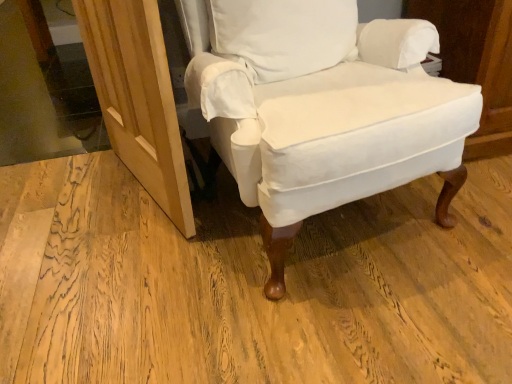
In order to face transparent glass door at upper left, should I rotate leftwards or rightwards?

Rotate left and turn 24.914 degrees.

Where is `white cotton chair at center`? The height and width of the screenshot is (384, 512). white cotton chair at center is located at coordinates (349, 134).

In order to face white cotton pillow at center, should I rotate leftwards or rightwards?

Turn right by 4.790 degrees to look at white cotton pillow at center.

Locate an element on the screen. The image size is (512, 384). natural wood screen door at lower left is located at coordinates (138, 98).

Locate an element on the screen. Image resolution: width=512 pixels, height=384 pixels. pillow on the right of transparent glass door at upper left is located at coordinates (284, 35).

Based on their positions, is white cotton pillow at center located to the left or right of transparent glass door at upper left?

From the image, it's evident that white cotton pillow at center is to the right of transparent glass door at upper left.

Who is shorter, white cotton pillow at center or transparent glass door at upper left?

transparent glass door at upper left.

Does point (336, 20) appear closer or farther from the camera than point (73, 132)?

Point (336, 20) appears to be closer to the viewer than point (73, 132).

Is transparent glass door at upper left at the back of natural wood screen door at lower left?

No, transparent glass door at upper left is not at the back of natural wood screen door at lower left.

Does natural wood screen door at lower left contain transparent glass door at upper left?

No, natural wood screen door at lower left does not contain transparent glass door at upper left.

Is natural wood screen door at lower left taller than transparent glass door at upper left?

Indeed, natural wood screen door at lower left has a greater height compared to transparent glass door at upper left.

Is natural wood screen door at lower left far away from transparent glass door at upper left?

Actually, natural wood screen door at lower left and transparent glass door at upper left are a little close together.

From the image's perspective, is transparent glass door at upper left on top of white cotton pillow at center?

Yes, from the image's perspective, transparent glass door at upper left is above white cotton pillow at center.

Which of these two, transparent glass door at upper left or white cotton pillow at center, is bigger?

transparent glass door at upper left is bigger.

Measure the distance between transparent glass door at upper left and white cotton pillow at center.

A distance of 1.35 meters exists between transparent glass door at upper left and white cotton pillow at center.

Is point (65, 100) behind point (347, 2)?

Yes, it is.

Does point (321, 55) lie behind point (172, 125)?

Yes, point (321, 55) is farther from viewer.

Can you confirm if white cotton pillow at center is taller than natural wood screen door at lower left?

In fact, white cotton pillow at center may be shorter than natural wood screen door at lower left.

Can you confirm if white cotton pillow at center is smaller than natural wood screen door at lower left?

Yes, white cotton pillow at center is smaller than natural wood screen door at lower left.

Which of these two, white cotton pillow at center or natural wood screen door at lower left, is thinner?

natural wood screen door at lower left.

Considering the relative positions of white cotton pillow at center and white cotton chair at center in the image provided, is white cotton pillow at center to the left of white cotton chair at center from the viewer's perspective?

Yes, white cotton pillow at center is to the left of white cotton chair at center.

Considering the points (214, 23) and (273, 87), which point is in front, point (214, 23) or point (273, 87)?

Positioned in front is point (273, 87).

Can you confirm if white cotton pillow at center is thinner than white cotton chair at center?

Indeed, white cotton pillow at center has a lesser width compared to white cotton chair at center.

In the scene shown: Which object is further away from the camera taking this photo, white cotton pillow at center or white cotton chair at center?

white cotton pillow at center.

Is point (452, 181) positioned in front of point (161, 110)?

No, it is behind (161, 110).

From the image's perspective, is white cotton chair at center above natural wood screen door at lower left?

Yes.

How many degrees apart are the facing directions of white cotton chair at center and natural wood screen door at lower left?

white cotton chair at center and natural wood screen door at lower left are facing 79.8 degrees away from each other.

Which is behind, white cotton chair at center or natural wood screen door at lower left?

natural wood screen door at lower left is behind.

This screenshot has height=384, width=512. What are the coordinates of `glass door above the white cotton chair at center (from the image's perspective)` in the screenshot? It's located at (44, 98).

From their relative heights in the image, would you say transparent glass door at upper left is taller or shorter than white cotton chair at center?

In the image, transparent glass door at upper left appears to be shorter than white cotton chair at center.

From a real-world perspective, is transparent glass door at upper left physically located above or below white cotton chair at center?

transparent glass door at upper left is situated lower than white cotton chair at center in the real world.

Is transparent glass door at upper left oriented towards white cotton chair at center?

No, transparent glass door at upper left does not turn towards white cotton chair at center.

Locate an element on the screen. The image size is (512, 384). pillow on the right of transparent glass door at upper left is located at coordinates (284, 35).

In order to click on glass door to the left of natural wood screen door at lower left in this screenshot , I will do `click(44, 98)`.

Looking at the image, which one is located closer to natural wood screen door at lower left, white cotton chair at center or transparent glass door at upper left?

white cotton chair at center is closer to natural wood screen door at lower left.

Considering their positions, is white cotton chair at center positioned closer to white cotton pillow at center than transparent glass door at upper left?

white cotton chair at center lies closer to white cotton pillow at center than the other object.

Looking at the image, which one is located further to white cotton pillow at center, transparent glass door at upper left or natural wood screen door at lower left?

Based on the image, transparent glass door at upper left appears to be further to white cotton pillow at center.

Which object lies nearer to the anchor point white cotton chair at center, transparent glass door at upper left or natural wood screen door at lower left?

The object closer to white cotton chair at center is natural wood screen door at lower left.

Estimate the real-world distances between objects in this image. Which object is further from natural wood screen door at lower left, transparent glass door at upper left or white cotton chair at center?

transparent glass door at upper left is further to natural wood screen door at lower left.

Looking at the image, which one is located closer to natural wood screen door at lower left, white cotton pillow at center or transparent glass door at upper left?

white cotton pillow at center is closer to natural wood screen door at lower left.

Looking at this image, which object lies nearer to the anchor point transparent glass door at upper left, white cotton pillow at center or natural wood screen door at lower left?

natural wood screen door at lower left lies closer to transparent glass door at upper left than the other object.

Estimate the real-world distances between objects in this image. Which object is further from natural wood screen door at lower left, white cotton pillow at center or white cotton chair at center?

Based on the image, white cotton pillow at center appears to be further to natural wood screen door at lower left.

Where is `pillow situated between transparent glass door at upper left and white cotton chair at center from left to right`? Image resolution: width=512 pixels, height=384 pixels. pillow situated between transparent glass door at upper left and white cotton chair at center from left to right is located at coordinates (284, 35).

The image size is (512, 384). I want to click on screen door located between transparent glass door at upper left and white cotton chair at center in the left-right direction, so click(x=138, y=98).

Find the location of a particular element. screen door between transparent glass door at upper left and white cotton pillow at center from left to right is located at coordinates (138, 98).

I want to click on pillow between natural wood screen door at lower left and white cotton chair at center from left to right, so click(284, 35).